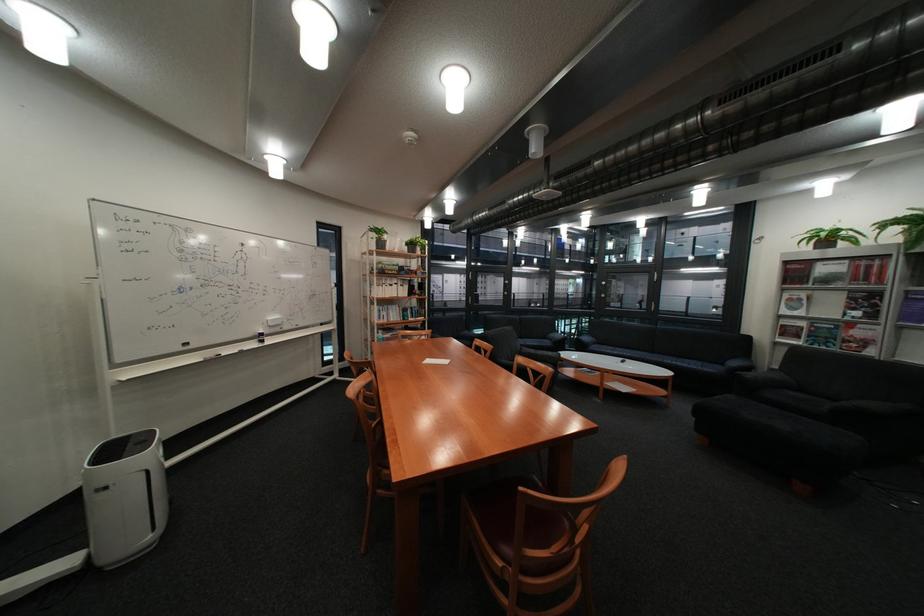
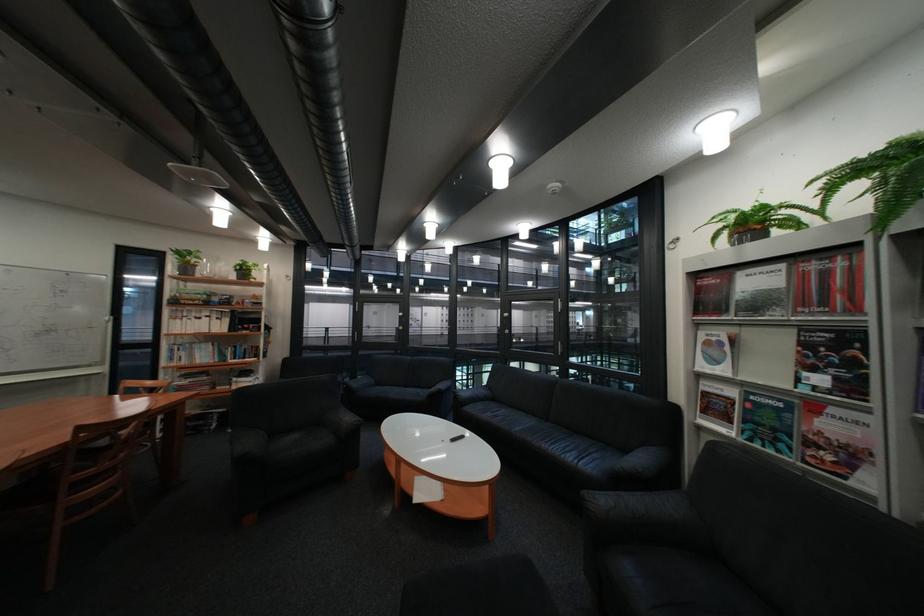
In a continuous first-person perspective shot, in which direction is the camera moving?

The movement direction of the cameraman is right, forward.